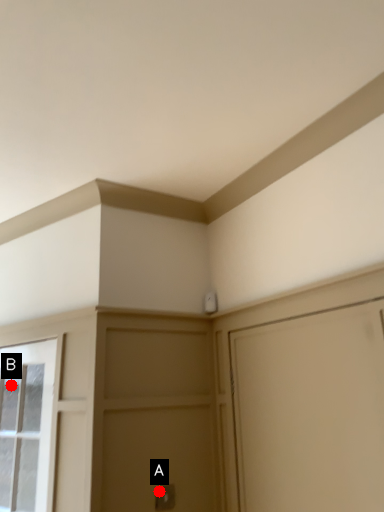
Question: Two points are circled on the image, labeled by A and B beside each circle. Which point is closer to the camera?

Choices:
 (A) A is closer
 (B) B is closer

Answer: (A)